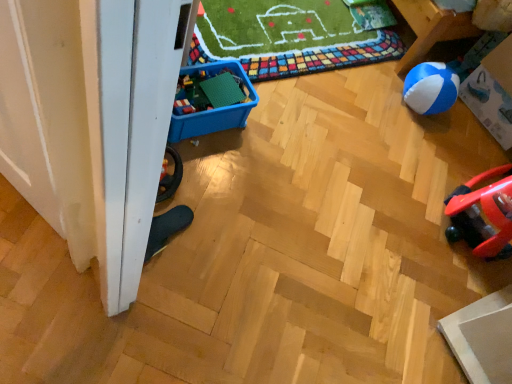
Based on the photo, how much space does blue and white plastic storage box at right, the 1th storage box when ordered from right to left, occupy vertically?

blue and white plastic storage box at right, the 1th storage box when ordered from right to left, is 43.02 centimeters in height.

This screenshot has height=384, width=512. What are the coordinates of `blue and white plastic storage box at right, the 1th storage box when ordered from right to left` in the screenshot? It's located at (492, 92).

Where is `green plastic building blocks at center-left`? The height and width of the screenshot is (384, 512). green plastic building blocks at center-left is located at coordinates (209, 92).

What do you see at coordinates (431, 88) in the screenshot? I see `blue and white rubber ball at right` at bounding box center [431, 88].

Find the location of a particular element. This screenshot has height=384, width=512. blue and white plastic storage box at right, which appears as the first storage box when viewed from the back is located at coordinates click(492, 92).

Is blue and white plastic storage box at right, the second storage box from the front, not close to blue plastic storage box at lower left, arranged as the first storage box when viewed from the front?

Yes, blue and white plastic storage box at right, the second storage box from the front, is far from blue plastic storage box at lower left, arranged as the first storage box when viewed from the front.

Is blue and white plastic storage box at right, the second storage box from the front, bigger than blue plastic storage box at lower left, the second storage box when ordered from right to left?

Yes.

Does point (473, 107) come behind point (182, 70)?

Yes, point (473, 107) is farther from viewer.

Can you confirm if blue and white plastic storage box at right, positioned as the 2th storage box in left-to-right order, is taller than blue plastic storage box at lower left, the second storage box when ordered from right to left?

Yes.

Is green plastic building blocks at center-left at the right side of blue plastic storage box at lower left, the second storage box when ordered from right to left?

Indeed, green plastic building blocks at center-left is positioned on the right side of blue plastic storage box at lower left, the second storage box when ordered from right to left.

From a real-world perspective, is green plastic building blocks at center-left located beneath blue plastic storage box at lower left, the second storage box when ordered from right to left?

No, from a real-world perspective, green plastic building blocks at center-left is not under blue plastic storage box at lower left, the second storage box when ordered from right to left.

Is point (183, 104) in front of point (188, 125)?

Yes, it is in front of point (188, 125).

How far apart are green plastic building blocks at center-left and blue plastic storage box at lower left, the second storage box when ordered from right to left?

green plastic building blocks at center-left and blue plastic storage box at lower left, the second storage box when ordered from right to left, are 4.57 centimeters apart from each other.

Does point (405, 97) lie in front of point (473, 110)?

Yes, it is in front of point (473, 110).

From the image's perspective, is blue and white rubber ball at right located above or below blue and white plastic storage box at right, positioned as the 2th storage box in left-to-right order?

blue and white rubber ball at right is situated lower than blue and white plastic storage box at right, positioned as the 2th storage box in left-to-right order, in the image.

Is blue and white rubber ball at right behind blue and white plastic storage box at right, the 1th storage box when ordered from right to left?

Yes, blue and white rubber ball at right is further from the camera.

At what (x,y) coordinates should I click in order to perform the action: click on storage box directly beneath the blue and white rubber ball at right (from a real-world perspective). Please return your answer as a coordinate pair (x, y). This screenshot has width=512, height=384. Looking at the image, I should click on (213, 109).

Consider the image. From a real-world perspective, relative to blue plastic storage box at lower left, arranged as the first storage box when viewed from the front, is blue and white rubber ball at right vertically above or below?

blue and white rubber ball at right is situated higher than blue plastic storage box at lower left, arranged as the first storage box when viewed from the front, in the real world.

From the image's perspective, is blue and white rubber ball at right located above blue plastic storage box at lower left, which is the second storage box from back to front?

Indeed, from the image's perspective, blue and white rubber ball at right is shown above blue plastic storage box at lower left, which is the second storage box from back to front.

From a real-world perspective, is blue and white plastic storage box at right, which appears as the first storage box when viewed from the back, physically located above or below blue and white rubber ball at right?

In terms of real-world spatial position, blue and white plastic storage box at right, which appears as the first storage box when viewed from the back, is above blue and white rubber ball at right.

How much distance is there between blue and white plastic storage box at right, the second storage box from the front, and blue and white rubber ball at right?

blue and white plastic storage box at right, the second storage box from the front, and blue and white rubber ball at right are 9.05 inches apart from each other.

Would you say blue and white plastic storage box at right, the 1th storage box when ordered from right to left, contains blue and white rubber ball at right?

No, blue and white plastic storage box at right, the 1th storage box when ordered from right to left, does not contain blue and white rubber ball at right.

Which is more to the right, blue and white plastic storage box at right, positioned as the 2th storage box in left-to-right order, or blue and white rubber ball at right?

From the viewer's perspective, blue and white plastic storage box at right, positioned as the 2th storage box in left-to-right order, appears more on the right side.

Considering the relative sizes of blue and white plastic storage box at right, which appears as the first storage box when viewed from the back, and green plastic building blocks at center-left in the image provided, is blue and white plastic storage box at right, which appears as the first storage box when viewed from the back, thinner than green plastic building blocks at center-left?

No, blue and white plastic storage box at right, which appears as the first storage box when viewed from the back, is not thinner than green plastic building blocks at center-left.

Is point (496, 133) more distant than point (209, 84)?

Yes, it is.

The width and height of the screenshot is (512, 384). Identify the location of toy in front of the blue and white plastic storage box at right, which appears as the first storage box when viewed from the back. (209, 92).

In the scene shown: From a real-world perspective, is green plastic building blocks at center-left over blue and white plastic storage box at right, positioned as the 2th storage box in left-to-right order?

Actually, green plastic building blocks at center-left is physically below blue and white plastic storage box at right, positioned as the 2th storage box in left-to-right order, in the real world.

Which of these two, green plastic building blocks at center-left or blue and white plastic storage box at right, which appears as the first storage box when viewed from the back, stands shorter?

With less height is green plastic building blocks at center-left.

In the image, is green plastic building blocks at center-left on the left side or the right side of blue and white plastic storage box at right, the second storage box from the front?

Based on their positions, green plastic building blocks at center-left is located to the left of blue and white plastic storage box at right, the second storage box from the front.

Is green plastic building blocks at center-left wider than blue and white plastic storage box at right, the 1th storage box when ordered from right to left?

In fact, green plastic building blocks at center-left might be narrower than blue and white plastic storage box at right, the 1th storage box when ordered from right to left.

You are a GUI agent. You are given a task and a screenshot of the screen. Output one action in this format:
    pyautogui.click(x=<x>, y=<y>)
    Task: Click on the storage box in front of the blue and white plastic storage box at right, which appears as the first storage box when viewed from the back
    Image resolution: width=512 pixels, height=384 pixels.
    Given the screenshot: What is the action you would take?
    pyautogui.click(x=213, y=109)

At what (x,y) coordinates should I click in order to perform the action: click on storage box below the green plastic building blocks at center-left (from the image's perspective). Please return your answer as a coordinate pair (x, y). The height and width of the screenshot is (384, 512). Looking at the image, I should click on (213, 109).

Looking at the image, which one is located closer to blue and white plastic storage box at right, positioned as the 2th storage box in left-to-right order, blue plastic storage box at lower left, the first storage box positioned from the left, or blue and white rubber ball at right?

blue and white rubber ball at right.

From the image, which object appears to be farther from blue and white plastic storage box at right, which appears as the first storage box when viewed from the back, green plastic building blocks at center-left or blue and white rubber ball at right?

The object further to blue and white plastic storage box at right, which appears as the first storage box when viewed from the back, is green plastic building blocks at center-left.

Looking at the image, which one is located further to blue and white rubber ball at right, blue plastic storage box at lower left, arranged as the first storage box when viewed from the front, or blue and white plastic storage box at right, the second storage box from the front?

The object further to blue and white rubber ball at right is blue plastic storage box at lower left, arranged as the first storage box when viewed from the front.

Based on their spatial positions, is blue and white rubber ball at right or blue and white plastic storage box at right, the 1th storage box when ordered from right to left, closer to blue plastic storage box at lower left, arranged as the first storage box when viewed from the front?

blue and white rubber ball at right.

Considering their positions, is blue and white plastic storage box at right, which appears as the first storage box when viewed from the back, positioned further to blue plastic storage box at lower left, which is the second storage box from back to front, than green plastic building blocks at center-left?

blue and white plastic storage box at right, which appears as the first storage box when viewed from the back.

Considering their positions, is blue and white plastic storage box at right, positioned as the 2th storage box in left-to-right order, positioned closer to green plastic building blocks at center-left than blue and white rubber ball at right?

Among the two, blue and white rubber ball at right is located nearer to green plastic building blocks at center-left.

From the image, which object appears to be nearer to blue and white rubber ball at right, blue plastic storage box at lower left, arranged as the first storage box when viewed from the front, or green plastic building blocks at center-left?

The object closer to blue and white rubber ball at right is blue plastic storage box at lower left, arranged as the first storage box when viewed from the front.

Estimate the real-world distances between objects in this image. Which object is further from blue and white plastic storage box at right, the 1th storage box when ordered from right to left, blue and white rubber ball at right or green plastic building blocks at center-left?

Among the two, green plastic building blocks at center-left is located further to blue and white plastic storage box at right, the 1th storage box when ordered from right to left.

Locate an element on the screen. The height and width of the screenshot is (384, 512). toy between blue plastic storage box at lower left, the second storage box when ordered from right to left, and blue and white plastic storage box at right, the 1th storage box when ordered from right to left is located at coordinates (209, 92).

This screenshot has height=384, width=512. Identify the location of toy between blue plastic storage box at lower left, the first storage box positioned from the left, and blue and white rubber ball at right. (209, 92).

The width and height of the screenshot is (512, 384). What are the coordinates of `ball between green plastic building blocks at center-left and blue and white plastic storage box at right, the 1th storage box when ordered from right to left` in the screenshot? It's located at (431, 88).

At what (x,y) coordinates should I click in order to perform the action: click on ball between blue plastic storage box at lower left, which is the second storage box from back to front, and blue and white plastic storage box at right, which appears as the first storage box when viewed from the back. Please return your answer as a coordinate pair (x, y). Image resolution: width=512 pixels, height=384 pixels. Looking at the image, I should click on (431, 88).